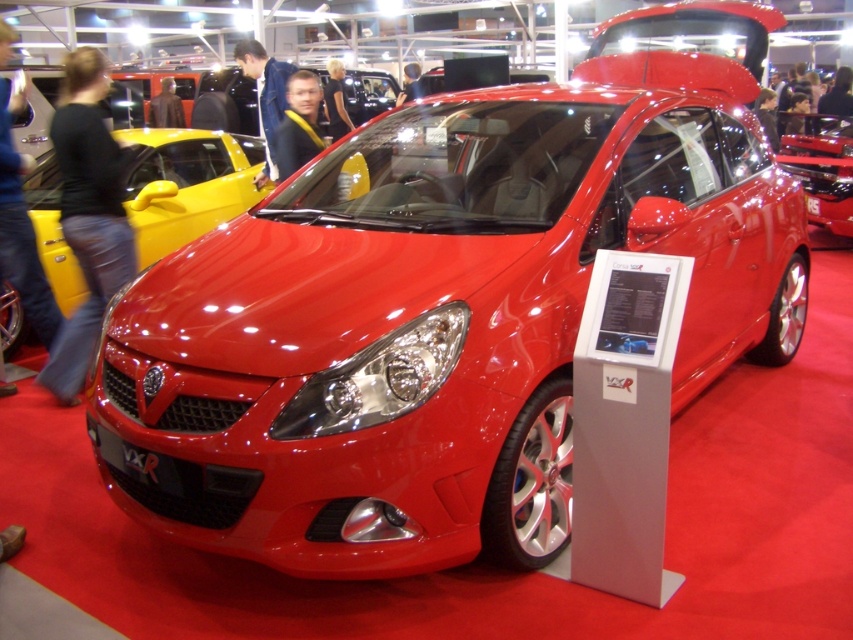
Which is more to the left, blue denim jacket at center or black leather jacket at center?

black leather jacket at center is more to the left.

Is blue denim jacket at center positioned in front of black leather jacket at center?

Yes, it is in front of black leather jacket at center.

Based on the photo, who is more forward, (273,173) or (332,77)?

Point (273,173) is more forward.

You are a GUI agent. You are given a task and a screenshot of the screen. Output one action in this format:
    pyautogui.click(x=<x>, y=<y>)
    Task: Click on the blue denim jacket at center
    The height and width of the screenshot is (640, 853).
    Given the screenshot: What is the action you would take?
    point(265,97)

Consider the image. Does black denim jeans at lower left appear over glossy red car at center?

Actually, black denim jeans at lower left is below glossy red car at center.

Between point (73, 244) and point (828, 116), which one is positioned behind?

The point (828, 116) is more distant.

Find the location of a particular element. The width and height of the screenshot is (853, 640). black denim jeans at lower left is located at coordinates (86, 214).

Can you confirm if black denim jeans at lower left is positioned to the left of matte black jacket at center?

Yes, black denim jeans at lower left is to the left of matte black jacket at center.

Which is in front, point (97, 289) or point (299, 150)?

Positioned in front is point (97, 289).

In the scene shown: Who is more distant from viewer, (x=97, y=51) or (x=312, y=154)?

The point (x=312, y=154) is more distant.

Where is `black denim jeans at lower left`? This screenshot has height=640, width=853. black denim jeans at lower left is located at coordinates (86, 214).